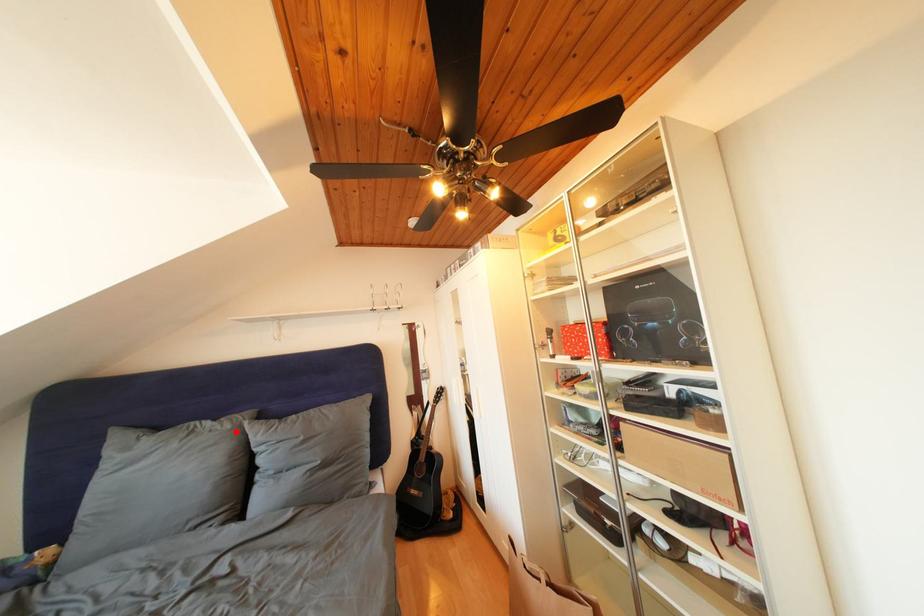
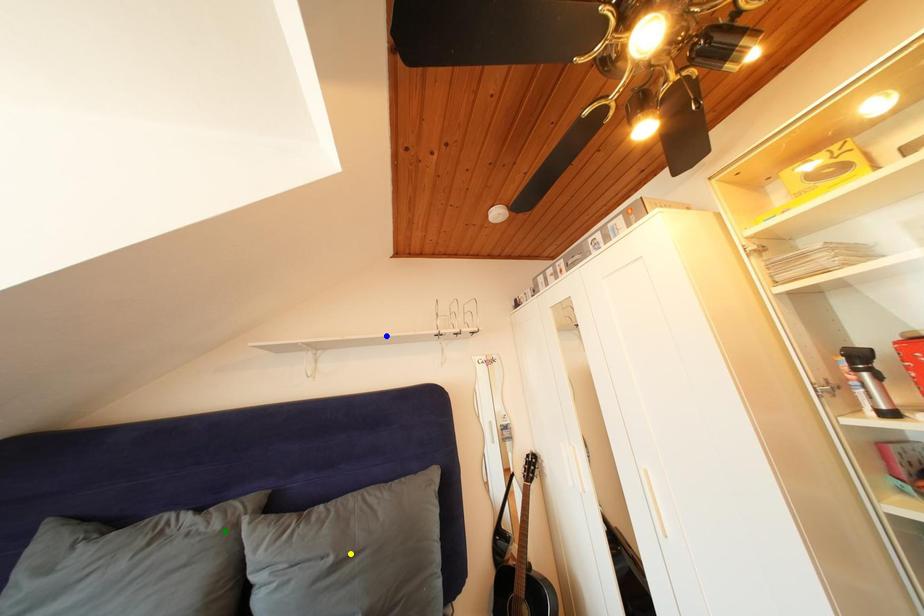
Question: I am providing you with two images of the same scene from different viewpoints. A red point is marked on the first image. You are given multiple points on the second image. Which mark in image 2 goes with the point in image 1?

Choices:
 (A) green point
 (B) yellow point
 (C) blue point

Answer: (A)